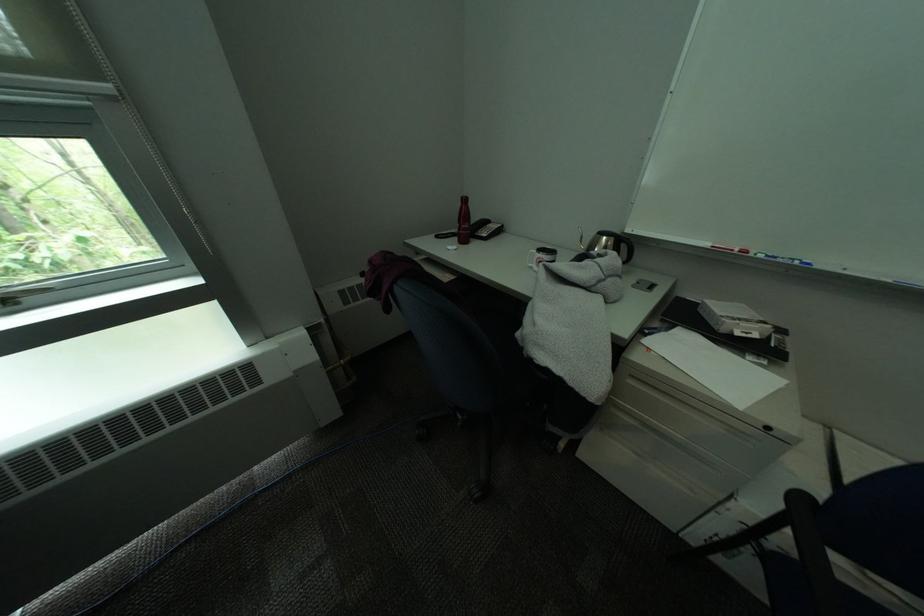
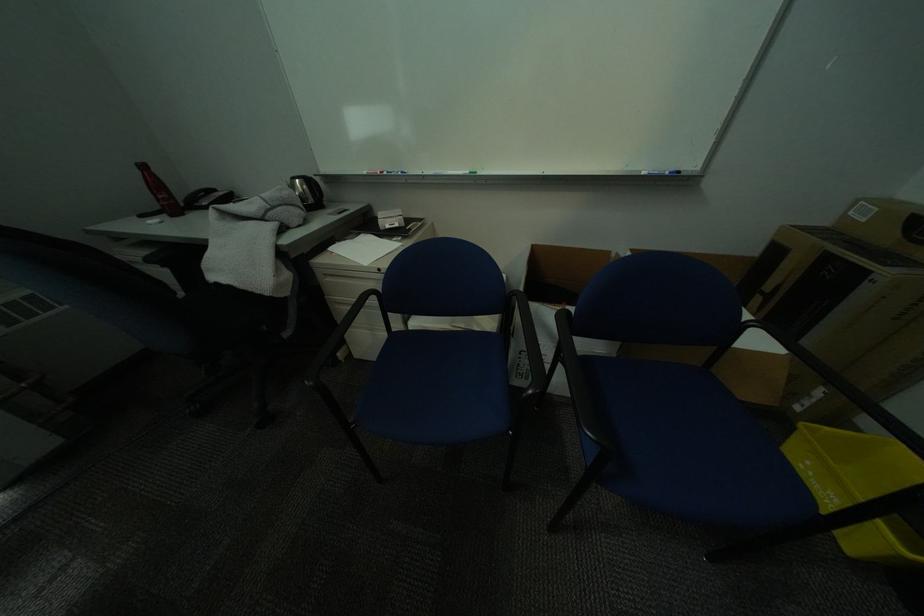
Question: The images are taken continuously from a first-person perspective. In which direction is your viewpoint rotating?

Choices:
 (A) Left
 (B) Right
 (C) Up
 (D) Down

Answer: (B)